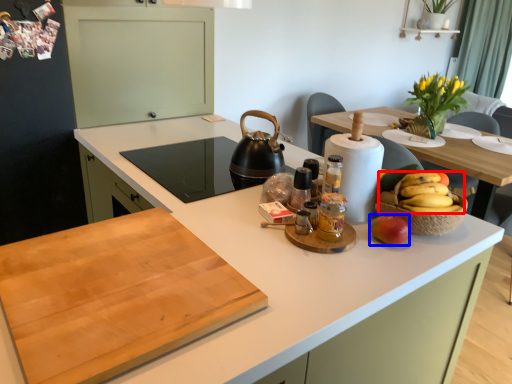
Question: Which object appears closest to the camera in this image, grapefruit (highlighted by a red box) or apple (highlighted by a blue box)?

Choices:
 (A) grapefruit
 (B) apple

Answer: (B)